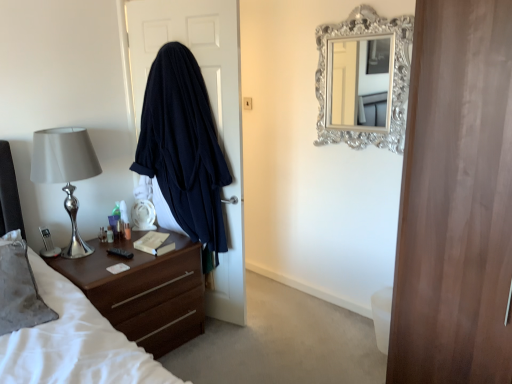
The height and width of the screenshot is (384, 512). What do you see at coordinates (211, 109) in the screenshot? I see `dark blue fabric at left` at bounding box center [211, 109].

What do you see at coordinates (65, 172) in the screenshot?
I see `silver metallic lamp at left` at bounding box center [65, 172].

Measure the distance between black plastic remote control at left and camera.

They are 7.71 feet apart.

The width and height of the screenshot is (512, 384). What are the coordinates of `translucent plastic bottle at left, which appears as the 2th bottle when viewed from the left` in the screenshot? It's located at (110, 235).

What do you see at coordinates (144, 291) in the screenshot? This screenshot has width=512, height=384. I see `brown wood vanity at lower left` at bounding box center [144, 291].

Where is `hardcover book at center`? hardcover book at center is located at coordinates tap(154, 243).

Can you confirm if translucent plastic bottle at left, marked as the 3th bottle in a right-to-left arrangement, is shorter than silver ornate mirror at upper center?

Correct, translucent plastic bottle at left, marked as the 3th bottle in a right-to-left arrangement, is not as tall as silver ornate mirror at upper center.

Which is behind, translucent plastic bottle at left, marked as the 3th bottle in a right-to-left arrangement, or silver ornate mirror at upper center?

translucent plastic bottle at left, marked as the 3th bottle in a right-to-left arrangement, is further away from the camera.

From a real-world perspective, is translucent plastic bottle at left, the first bottle positioned from the left, beneath silver ornate mirror at upper center?

Yes, from a real-world perspective, translucent plastic bottle at left, the first bottle positioned from the left, is under silver ornate mirror at upper center.

From a real-world perspective, starting from the silver ornate mirror at upper center, which bottle is the 3rd one below it? Please provide its 2D coordinates.

[(102, 234)]

Which is more to the left, black plastic remote control at left or hardcover book at center?

Positioned to the left is black plastic remote control at left.

Is black plastic remote control at left spatially inside hardcover book at center, or outside of it?

black plastic remote control at left is not enclosed by hardcover book at center.

Based on their sizes in the image, would you say black plastic remote control at left is bigger or smaller than hardcover book at center?

Considering their sizes, black plastic remote control at left takes up less space than hardcover book at center.

From a real-world perspective, relative to hardcover book at center, is black plastic remote control at left vertically above or below?

black plastic remote control at left is situated lower than hardcover book at center in the real world.

Identify the location of bottle below the translucent plastic bottle at left, which is the second bottle from right to left (from the image's perspective). (102, 234).

Considering the sizes of translucent plastic bottle at left, which appears as the 2th bottle when viewed from the left, and translucent plastic bottle at left, marked as the 3th bottle in a right-to-left arrangement, in the image, is translucent plastic bottle at left, which appears as the 2th bottle when viewed from the left, wider or thinner than translucent plastic bottle at left, marked as the 3th bottle in a right-to-left arrangement,?

Clearly, translucent plastic bottle at left, which appears as the 2th bottle when viewed from the left, has less width compared to translucent plastic bottle at left, marked as the 3th bottle in a right-to-left arrangement.

Is translucent plastic bottle at left, which is the second bottle from right to left, placed right next to translucent plastic bottle at left, the first bottle positioned from the left?

Yes, translucent plastic bottle at left, which is the second bottle from right to left, is right next to translucent plastic bottle at left, the first bottle positioned from the left, and making contact.

Can translucent plastic bottle at left, marked as the 3th bottle in a right-to-left arrangement, be found inside translucent plastic bottle at left, which is the second bottle from right to left?

No, translucent plastic bottle at left, which is the second bottle from right to left, does not contain translucent plastic bottle at left, marked as the 3th bottle in a right-to-left arrangement.

From the image's perspective, would you say silver metallic lamp at left is positioned over translucent plastic bottle at left, which appears as the 2th bottle when viewed from the left?

Yes, from the image's perspective, silver metallic lamp at left is above translucent plastic bottle at left, which appears as the 2th bottle when viewed from the left.

From a real-world perspective, is silver metallic lamp at left physically below translucent plastic bottle at left, which appears as the 2th bottle when viewed from the left?

Actually, silver metallic lamp at left is physically above translucent plastic bottle at left, which appears as the 2th bottle when viewed from the left, in the real world.

Is silver metallic lamp at left wider than translucent plastic bottle at left, which is the second bottle from right to left?

Correct, the width of silver metallic lamp at left exceeds that of translucent plastic bottle at left, which is the second bottle from right to left.

Is point (347, 90) positioned in front of point (100, 232)?

No, (347, 90) is behind (100, 232).

Based on the photo, can you confirm if silver ornate mirror at upper center is smaller than translucent plastic bottle at left, the first bottle positioned from the left?

No, silver ornate mirror at upper center is not smaller than translucent plastic bottle at left, the first bottle positioned from the left.

Based on the photo, from a real-world perspective, between silver ornate mirror at upper center and translucent plastic bottle at left, the first bottle positioned from the left, who is vertically lower?

translucent plastic bottle at left, the first bottle positioned from the left.

Is translucent plastic bottle at bedside, the third bottle positioned from the left, facing towards translucent plastic bottle at left, which is the second bottle from right to left?

No, translucent plastic bottle at bedside, the third bottle positioned from the left, is not oriented towards translucent plastic bottle at left, which is the second bottle from right to left.

From the picture: Relative to translucent plastic bottle at left, which is the second bottle from right to left, is translucent plastic bottle at bedside, the third bottle positioned from the left, in front or behind?

translucent plastic bottle at bedside, the third bottle positioned from the left, is positioned farther from the viewer than translucent plastic bottle at left, which is the second bottle from right to left.

Considering the relative positions of translucent plastic bottle at bedside, which is the 1th bottle from right to left, and translucent plastic bottle at left, which is the second bottle from right to left, in the image provided, is translucent plastic bottle at bedside, which is the 1th bottle from right to left, to the right of translucent plastic bottle at left, which is the second bottle from right to left, from the viewer's perspective?

Yes.

Which is correct: translucent plastic bottle at bedside, which is the 1th bottle from right to left, is inside translucent plastic bottle at left, which is the second bottle from right to left, or outside of it?

translucent plastic bottle at bedside, which is the 1th bottle from right to left, is spatially situated outside translucent plastic bottle at left, which is the second bottle from right to left.

Consider the image. Is translucent plastic bottle at bedside, which is the 1th bottle from right to left, next to brown wood vanity at lower left?

translucent plastic bottle at bedside, which is the 1th bottle from right to left, and brown wood vanity at lower left are clearly separated.

In the image, is translucent plastic bottle at bedside, the third bottle positioned from the left, on the left side or the right side of brown wood vanity at lower left?

In the image, translucent plastic bottle at bedside, the third bottle positioned from the left, appears on the left side of brown wood vanity at lower left.

Does translucent plastic bottle at bedside, which is the 1th bottle from right to left, have a lesser height compared to brown wood vanity at lower left?

Yes.

How many degrees apart are the facing directions of translucent plastic bottle at bedside, the third bottle positioned from the left, and brown wood vanity at lower left?

The angle between the facing direction of translucent plastic bottle at bedside, the third bottle positioned from the left, and the facing direction of brown wood vanity at lower left is 4.36 degrees.

Locate an element on the screen. This screenshot has width=512, height=384. mirror in front of the translucent plastic bottle at left, marked as the 3th bottle in a right-to-left arrangement is located at coordinates [x=364, y=80].

This screenshot has height=384, width=512. I want to click on book that is on the right side of black plastic remote control at left, so click(x=154, y=243).

Looking at the image, which one is located closer to brown wood vanity at lower left, hardcover book at center or dark blue fabric at left?

Based on the image, hardcover book at center appears to be nearer to brown wood vanity at lower left.

From the image, which object appears to be nearer to translucent plastic bottle at left, marked as the 3th bottle in a right-to-left arrangement, translucent plastic bottle at bedside, which is the 1th bottle from right to left, or silver ornate mirror at upper center?

translucent plastic bottle at bedside, which is the 1th bottle from right to left.

Estimate the real-world distances between objects in this image. Which object is further from translucent plastic bottle at bedside, which is the 1th bottle from right to left, dark blue fabric at left or brown wood vanity at lower left?

Among the two, dark blue fabric at left is located further to translucent plastic bottle at bedside, which is the 1th bottle from right to left.

Looking at the image, which one is located closer to translucent plastic bottle at left, the first bottle positioned from the left, silver ornate mirror at upper center or hardcover book at center?

The object closer to translucent plastic bottle at left, the first bottle positioned from the left, is hardcover book at center.

Looking at the image, which one is located closer to silver metallic lamp at left, translucent plastic bottle at bedside, which is the 1th bottle from right to left, or brown wood vanity at lower left?

brown wood vanity at lower left lies closer to silver metallic lamp at left than the other object.

Which object lies further to the anchor point translucent plastic bottle at left, marked as the 3th bottle in a right-to-left arrangement, silver metallic lamp at left or brown wood vanity at lower left?

The object further to translucent plastic bottle at left, marked as the 3th bottle in a right-to-left arrangement, is brown wood vanity at lower left.

Which object lies further to the anchor point silver ornate mirror at upper center, black plastic remote control at left or translucent plastic bottle at left, marked as the 3th bottle in a right-to-left arrangement?

translucent plastic bottle at left, marked as the 3th bottle in a right-to-left arrangement.

When comparing their distances from dark blue fabric at left, does translucent plastic bottle at left, marked as the 3th bottle in a right-to-left arrangement, or silver ornate mirror at upper center seem closer?

The object closer to dark blue fabric at left is silver ornate mirror at upper center.

Where is `bottle between brown wood vanity at lower left and translucent plastic bottle at left, the first bottle positioned from the left, from front to back`? The height and width of the screenshot is (384, 512). bottle between brown wood vanity at lower left and translucent plastic bottle at left, the first bottle positioned from the left, from front to back is located at coordinates (110, 235).

What are the coordinates of `book between translucent plastic bottle at left, marked as the 3th bottle in a right-to-left arrangement, and silver ornate mirror at upper center, in the horizontal direction` in the screenshot? It's located at (154, 243).

Identify the location of remote control between silver metallic lamp at left and translucent plastic bottle at bedside, the third bottle positioned from the left, from front to back. The height and width of the screenshot is (384, 512). (120, 253).

Find the location of `remote control that lies between silver metallic lamp at left and brown wood vanity at lower left from top to bottom`. remote control that lies between silver metallic lamp at left and brown wood vanity at lower left from top to bottom is located at coordinates (120, 253).